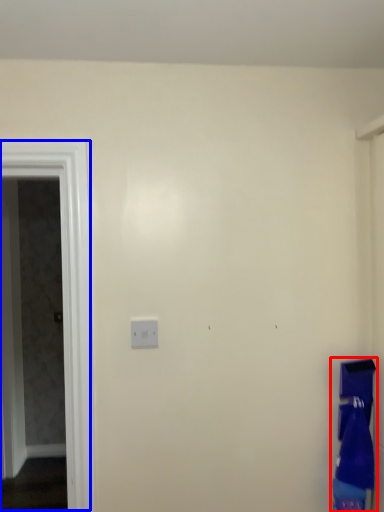
Question: Which object appears farthest to the camera in this image, laundry (highlighted by a red box) or screen door (highlighted by a blue box)?

Choices:
 (A) laundry
 (B) screen door

Answer: (B)